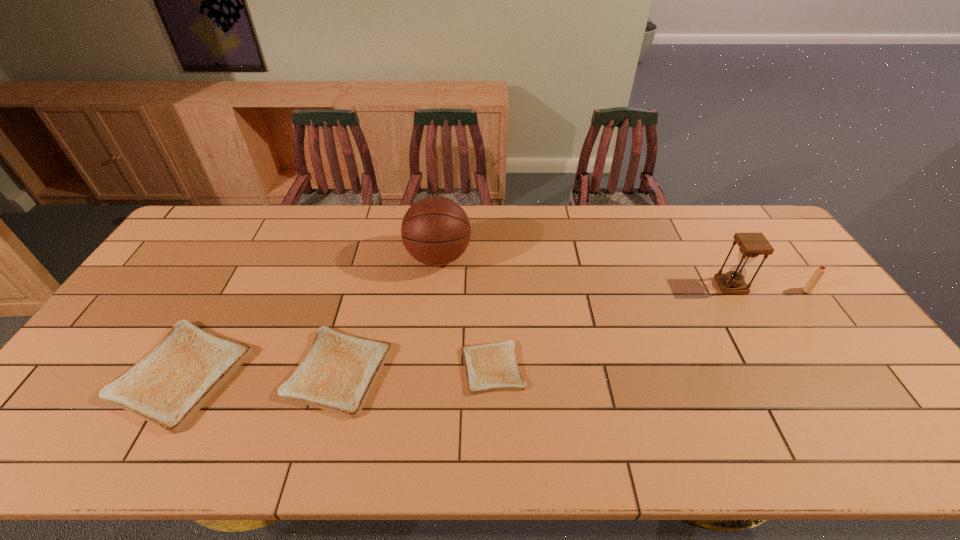
Please point out where to position a new toast on the right to maintain spacing. Please provide its 2D coordinates. Your answer should be formatted as a tuple, i.e. [(x, y)], where the tuple contains the x and y coordinates of a point satisfying the conditions above.

[(646, 364)]